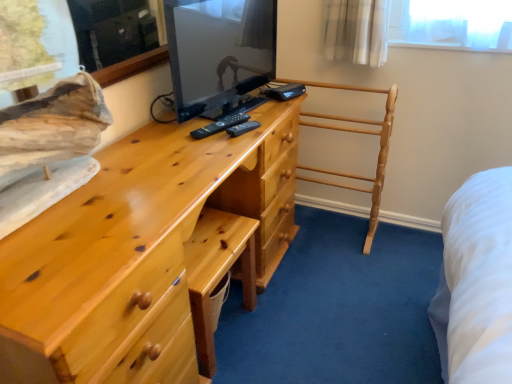
Question: Does matte pine chest of drawers at center have a lesser height compared to light brown wooden towel rack at center?

Choices:
 (A) yes
 (B) no

Answer: (B)

Question: Is matte pine chest of drawers at center not inside light brown wooden towel rack at center?

Choices:
 (A) no
 (B) yes

Answer: (B)

Question: Is matte pine chest of drawers at center turned away from light brown wooden towel rack at center?

Choices:
 (A) no
 (B) yes

Answer: (A)

Question: Is matte pine chest of drawers at center wider than light brown wooden towel rack at center?

Choices:
 (A) no
 (B) yes

Answer: (B)

Question: Is matte pine chest of drawers at center not near light brown wooden towel rack at center?

Choices:
 (A) yes
 (B) no

Answer: (B)

Question: Does matte pine chest of drawers at center turn towards light brown wooden towel rack at center?

Choices:
 (A) no
 (B) yes

Answer: (A)

Question: Is matte pine chest of drawers at center at the left side of matte black tv at center?

Choices:
 (A) no
 (B) yes

Answer: (B)

Question: Is matte pine chest of drawers at center outside matte black tv at center?

Choices:
 (A) no
 (B) yes

Answer: (B)

Question: Is matte pine chest of drawers at center next to matte black tv at center?

Choices:
 (A) no
 (B) yes

Answer: (A)

Question: From a real-world perspective, is matte pine chest of drawers at center under matte black tv at center?

Choices:
 (A) no
 (B) yes

Answer: (B)

Question: Does matte pine chest of drawers at center have a greater width compared to matte black tv at center?

Choices:
 (A) no
 (B) yes

Answer: (B)

Question: From a real-world perspective, is matte pine chest of drawers at center on matte black tv at center?

Choices:
 (A) yes
 (B) no

Answer: (B)

Question: Considering the relative sizes of light brown wooden towel rack at center and black plastic remote at center in the image provided, is light brown wooden towel rack at center taller than black plastic remote at center?

Choices:
 (A) no
 (B) yes

Answer: (B)